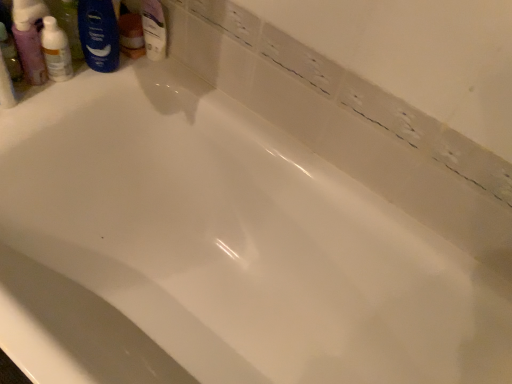
Locate an element on the screen. This screenshot has width=512, height=384. free location in front of translucent plastic bottle at upper left is located at coordinates (38, 98).